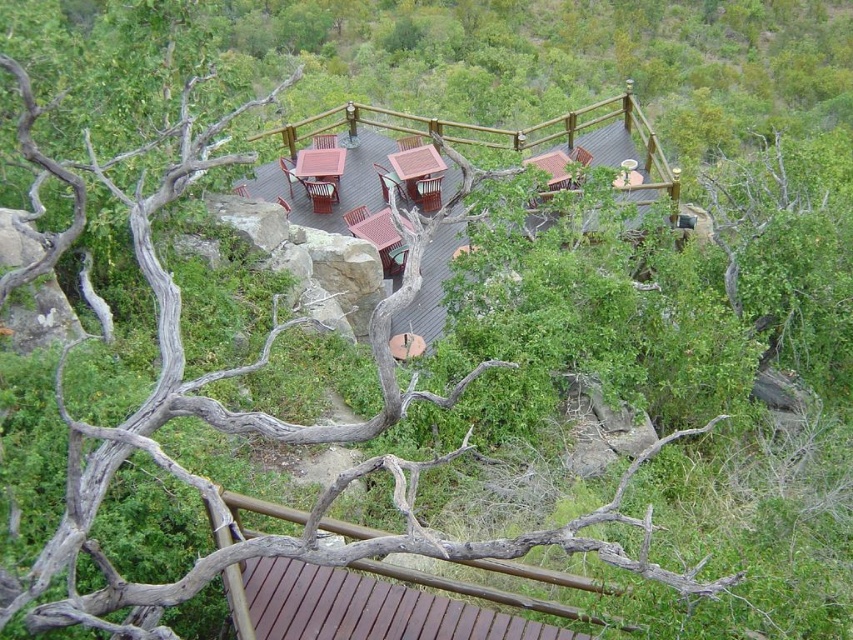
Question: Observing the image, what is the correct spatial positioning of brown wood deck at lower center in reference to brown wooden table at center?

Choices:
 (A) left
 (B) right

Answer: (B)

Question: Among these points, which one is nearest to the camera?

Choices:
 (A) (427, 204)
 (B) (541, 156)

Answer: (A)

Question: Is wooden deck at center to the left of brown wood deck at lower center from the viewer's perspective?

Choices:
 (A) no
 (B) yes

Answer: (B)

Question: Which object is the farthest from the wooden deck at center?

Choices:
 (A) brown wooden hut at upper right
 (B) brown wooden table at center
 (C) wooden hut at center
 (D) brown wood deck at lower center

Answer: (D)

Question: Based on their relative distances, which object is farther from the wooden hut at center?

Choices:
 (A) brown wooden hut at upper right
 (B) brown wood deck at lower center
 (C) wooden deck at center
 (D) brown wooden table at center

Answer: (B)

Question: Can you confirm if brown wooden table at center is thinner than brown wooden hut at upper right?

Choices:
 (A) no
 (B) yes

Answer: (A)